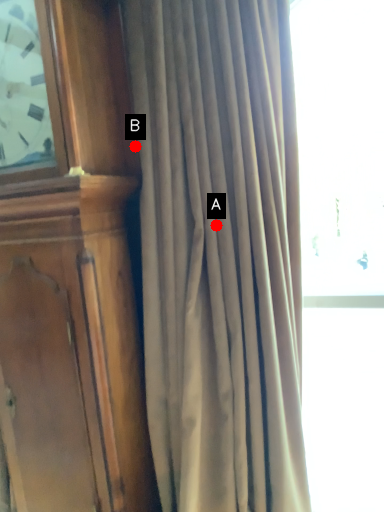
Question: Two points are circled on the image, labeled by A and B beside each circle. Among these points, which one is farthest from the camera?

Choices:
 (A) A is further
 (B) B is further

Answer: (B)